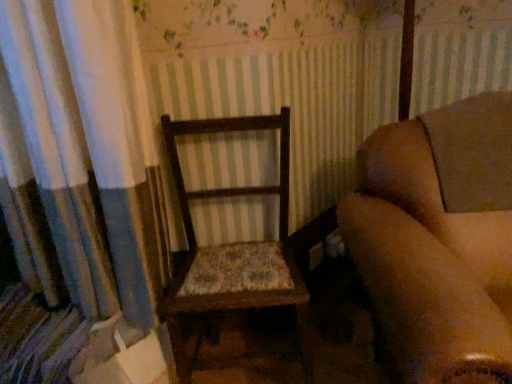
Question: Is wooden chair at center wider than wooden chair with floral cushion at center?

Choices:
 (A) yes
 (B) no

Answer: (A)

Question: Is wooden chair at center looking in the opposite direction of wooden chair with floral cushion at center?

Choices:
 (A) yes
 (B) no

Answer: (B)

Question: Is wooden chair at center bigger than wooden chair with floral cushion at center?

Choices:
 (A) yes
 (B) no

Answer: (A)

Question: Is wooden chair at center oriented towards wooden chair with floral cushion at center?

Choices:
 (A) no
 (B) yes

Answer: (A)

Question: Is wooden chair at center located outside wooden chair with floral cushion at center?

Choices:
 (A) yes
 (B) no

Answer: (A)

Question: Is wooden chair at center closer to camera compared to wooden chair with floral cushion at center?

Choices:
 (A) yes
 (B) no

Answer: (A)

Question: Is wooden chair with floral cushion at center positioned with its back to wooden chair at center?

Choices:
 (A) no
 (B) yes

Answer: (A)

Question: Does wooden chair with floral cushion at center appear on the left side of wooden chair at center?

Choices:
 (A) yes
 (B) no

Answer: (A)

Question: Is wooden chair with floral cushion at center behind wooden chair at center?

Choices:
 (A) yes
 (B) no

Answer: (A)

Question: From the image's perspective, is wooden chair with floral cushion at center on top of wooden chair at center?

Choices:
 (A) yes
 (B) no

Answer: (A)

Question: Does wooden chair with floral cushion at center have a smaller size compared to wooden chair at center?

Choices:
 (A) yes
 (B) no

Answer: (A)

Question: From a real-world perspective, is wooden chair with floral cushion at center physically below wooden chair at center?

Choices:
 (A) no
 (B) yes

Answer: (B)

Question: Is point (265, 248) closer or farther from the camera than point (413, 236)?

Choices:
 (A) farther
 (B) closer

Answer: (A)